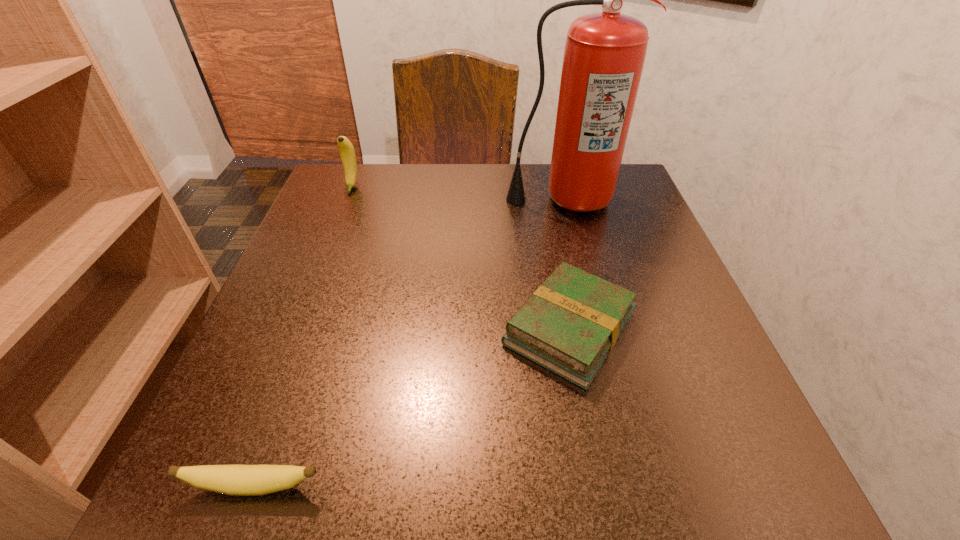
At what (x,y) coordinates should I click in order to perform the action: click on fire extinguisher. Please return your answer as a coordinate pair (x, y). The height and width of the screenshot is (540, 960). Looking at the image, I should click on (604, 55).

At what (x,y) coordinates should I click in order to perform the action: click on the farther banana. Please return your answer as a coordinate pair (x, y). The height and width of the screenshot is (540, 960). Looking at the image, I should click on 346,149.

Locate an element on the screen. the third shortest object is located at coordinates (346, 149).

I want to click on the second nearest object, so click(x=569, y=325).

The width and height of the screenshot is (960, 540). I want to click on the nearest object, so click(x=237, y=480).

Locate an element on the screen. the shorter banana is located at coordinates 237,480.

Identify the location of vacant space located 0.150m on the instruction side of the fire extinguisher. (579, 264).

The height and width of the screenshot is (540, 960). Identify the location of vacant space situated 0.170m from the stem of the taller banana. (330, 240).

You are a GUI agent. You are given a task and a screenshot of the screen. Output one action in this format:
    pyautogui.click(x=<x>, y=<y>)
    Task: Click on the free location located on the back of the second nearest object
    
    Given the screenshot: What is the action you would take?
    pyautogui.click(x=548, y=219)

In order to click on vacant position located on the right of the nearer banana in this screenshot , I will do `click(519, 487)`.